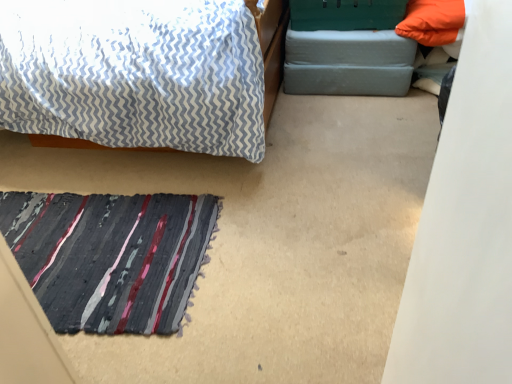
The height and width of the screenshot is (384, 512). Find the location of `vacant space in front of gray fabric footrest at upper right`. vacant space in front of gray fabric footrest at upper right is located at coordinates (336, 118).